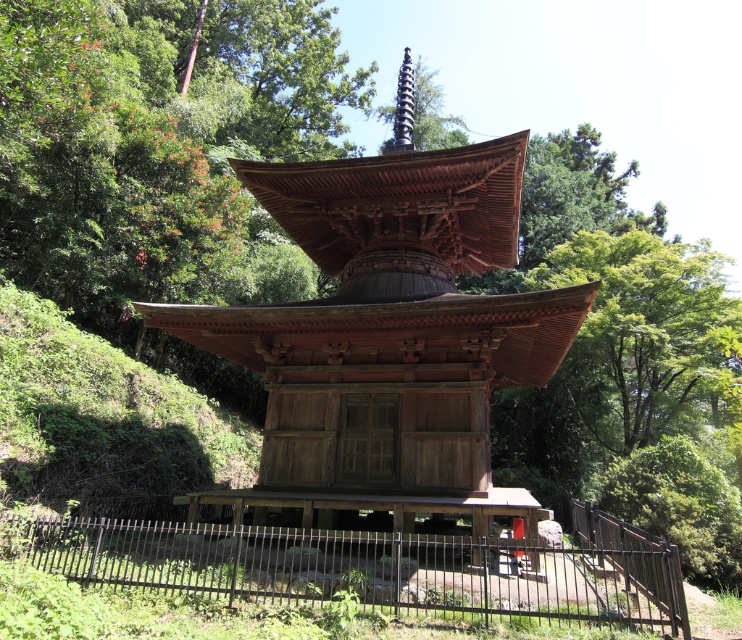
Which of these two, wooden pagoda at center or black wrought iron fence at lower center, stands shorter?

Standing shorter between the two is black wrought iron fence at lower center.

This screenshot has height=640, width=742. I want to click on wooden pagoda at center, so click(x=387, y=336).

Is point (393, 273) farther from viewer compared to point (171, 554)?

Yes, point (393, 273) is behind point (171, 554).

Find the location of a particular element. The width and height of the screenshot is (742, 640). wooden pagoda at center is located at coordinates (387, 336).